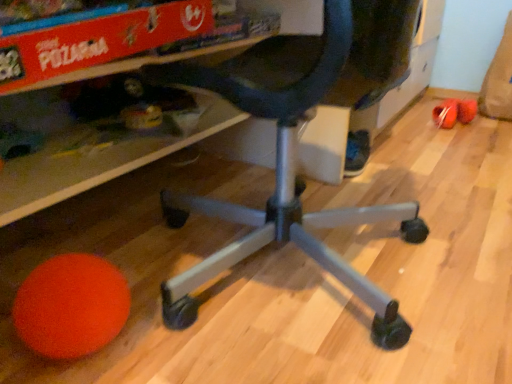
What are the coordinates of `vacant space to the right of rubberized plastic ball at lower left` in the screenshot? It's located at (489, 131).